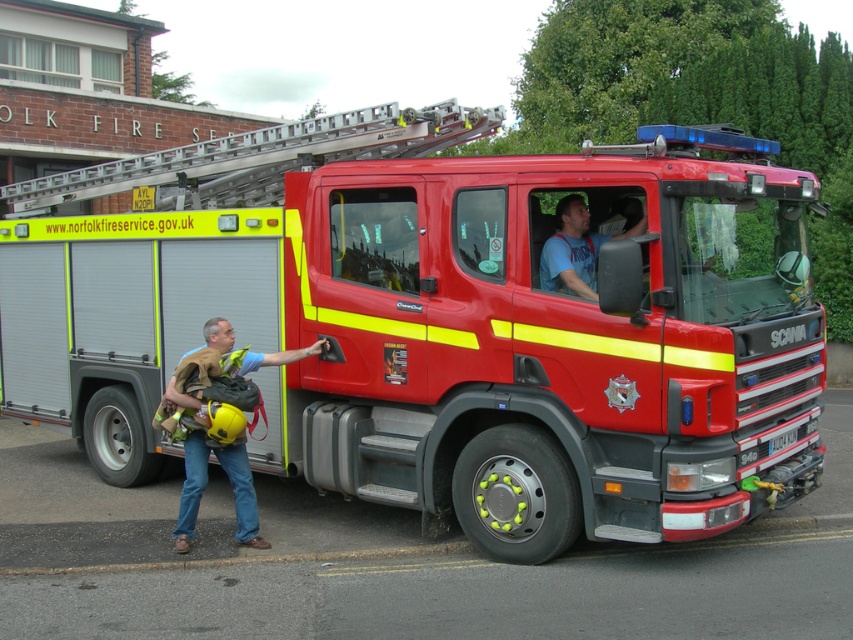
Does point (260, 179) come in front of point (631, 234)?

No, it is behind (631, 234).

Is the position of silver metallic ladder at upper center less distant than that of blue cotton shirt at center?

No, silver metallic ladder at upper center is further to the viewer.

Between point (277, 198) and point (641, 216), which one is positioned behind?

Point (277, 198)

In order to click on silver metallic ladder at upper center in this screenshot , I will do `click(259, 157)`.

Can you confirm if hard hat at left is taller than blue cotton shirt at center?

Yes.

Who is lower down, hard hat at left or blue cotton shirt at center?

Positioned lower is hard hat at left.

Between point (321, 346) and point (572, 209), which one is positioned in front?

Point (572, 209) is more forward.

I want to click on hard hat at left, so click(x=190, y=490).

Which is above, metallic red fire truck at center or blue cotton shirt at center?

metallic red fire truck at center is higher up.

Where is `metallic red fire truck at center`? metallic red fire truck at center is located at coordinates (460, 337).